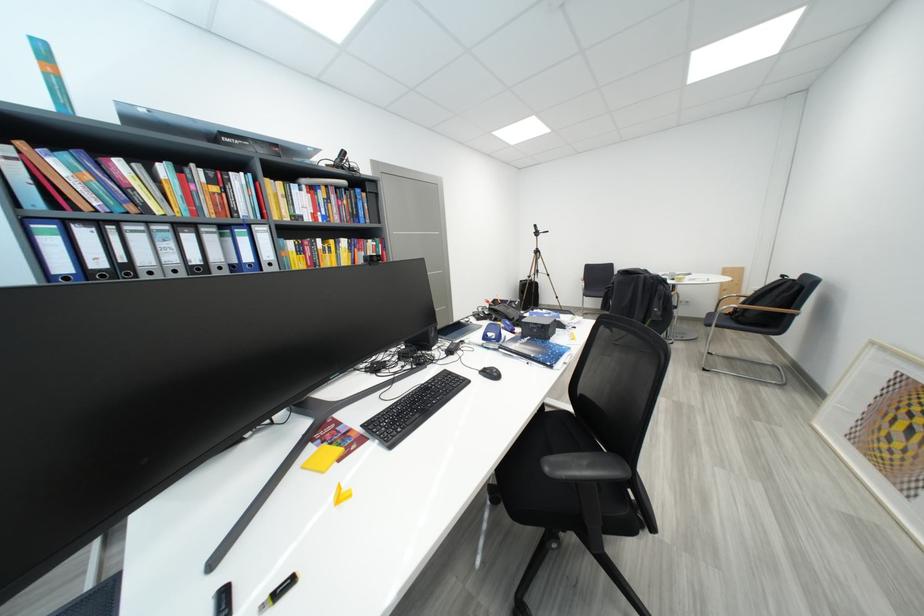
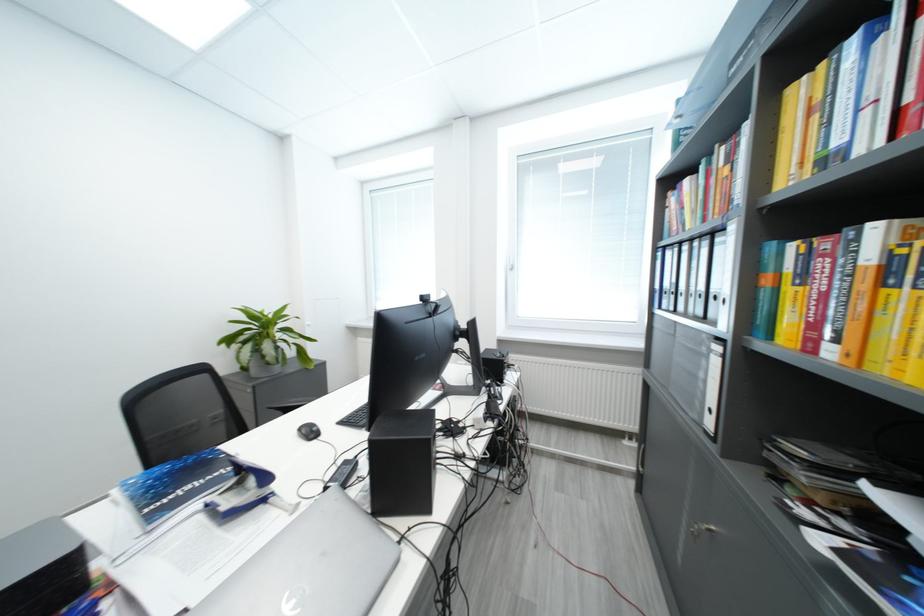
Locate, in the second image, the point that corresponds to (304,188) in the first image.

(861, 44)